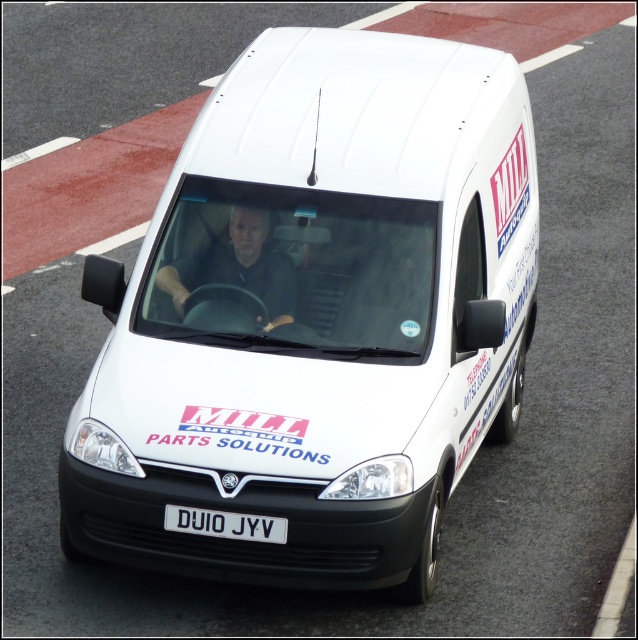
Question: Which point is closer to the camera taking this photo?

Choices:
 (A) (195, 276)
 (B) (230, 496)
 (C) (223, 522)

Answer: (B)

Question: Which point appears closest to the camera in this image?

Choices:
 (A) (181, 276)
 (B) (216, 524)
 (C) (219, 378)

Answer: (B)

Question: Does white matte van at center appear on the left side of matte black steering wheel at center?

Choices:
 (A) no
 (B) yes

Answer: (A)

Question: In this image, where is white matte van at center located relative to white plastic license plate at center?

Choices:
 (A) left
 (B) right

Answer: (B)

Question: Among these points, which one is farthest from the camera?

Choices:
 (A) (209, 410)
 (B) (255, 276)

Answer: (B)

Question: Is white matte van at center wider than matte black steering wheel at center?

Choices:
 (A) yes
 (B) no

Answer: (A)